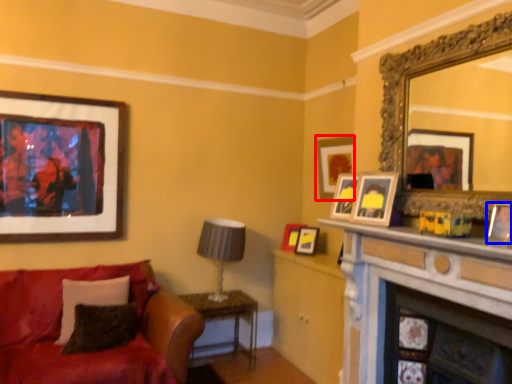
Question: Among these objects, which one is farthest to the camera, picture frame (highlighted by a red box) or picture frame (highlighted by a blue box)?

Choices:
 (A) picture frame
 (B) picture frame

Answer: (A)